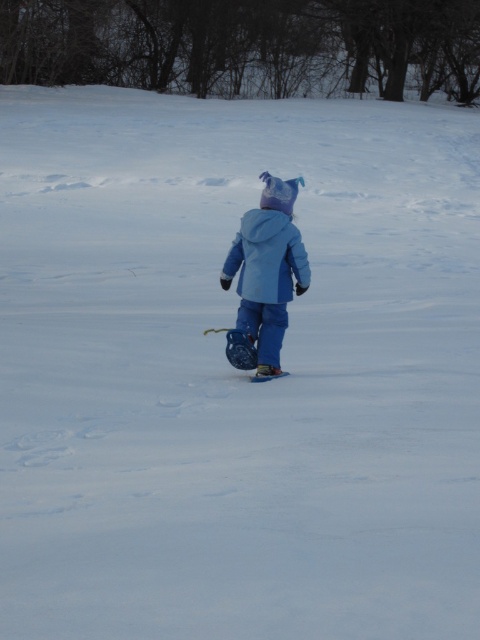
Consider the image. Which of these two, matte blue snowsuit at center or matte blue jacket at center, stands shorter?

matte blue jacket at center is shorter.

Is the position of matte blue snowsuit at center less distant than that of matte blue jacket at center?

Yes.

This screenshot has height=640, width=480. What do you see at coordinates (265, 275) in the screenshot?
I see `matte blue snowsuit at center` at bounding box center [265, 275].

What are the coordinates of `matte blue snowsuit at center` in the screenshot? It's located at (265, 275).